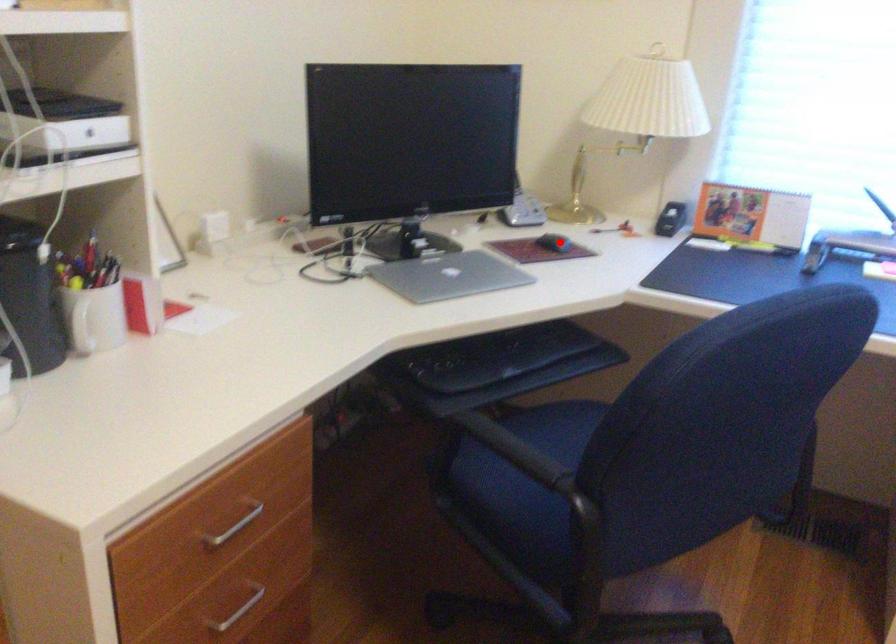
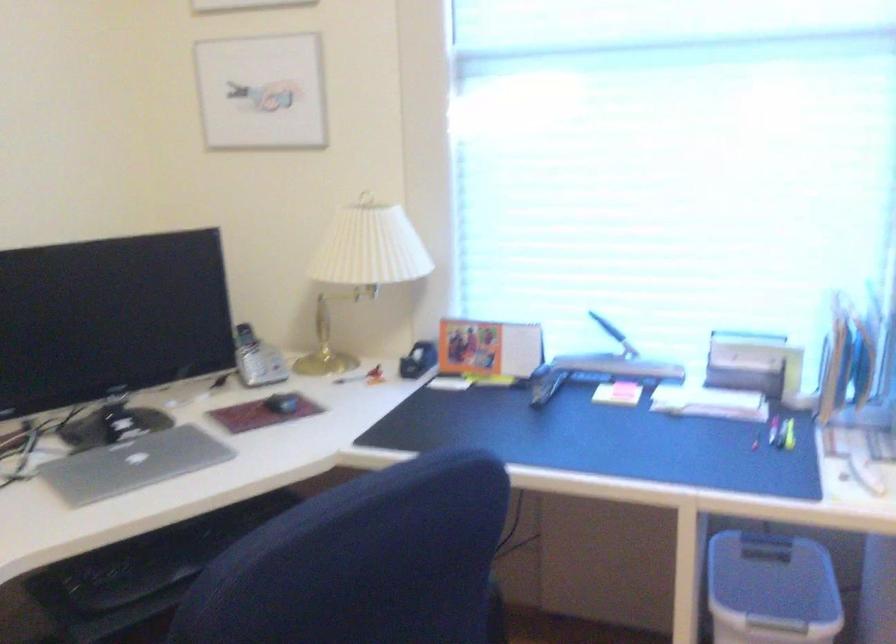
Where in the second image is the point corresponding to the highlighted location from the first image?

(281, 402)